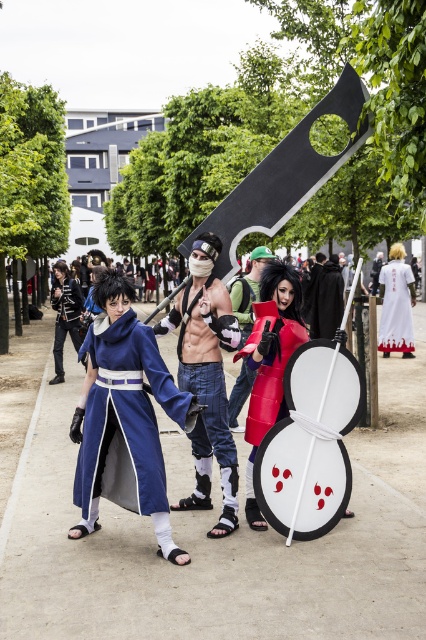
You are a photographer trying to capture the perfect shot of the matte red shield at center. Based on its position in the scene, where should you aim your camera to ensure it is centered in your viewfinder?

You should aim your camera at point (270, 364) to center the matte red shield at center in your viewfinder since that is its exact location.

You are a photographer trying to capture a clear shot of the matte blue fabric coat at left and the matte black armor at left. Since the coat is positioned under the armor, will the armor block the view of the coat in your photo?

The matte blue fabric coat at left is positioned under the matte black armor at left, so the armor will block part of the coat from view.

Looking at this image, you are standing at the center of the park and want to take a photo of both point (138, 508) and point (72, 317). Which point should you focus on first to ensure both are in focus?

You should focus on point (72, 317) first because it is farther from the camera compared to point (138, 508). By focusing on the farther point, both points will be in focus due to the depth of field.